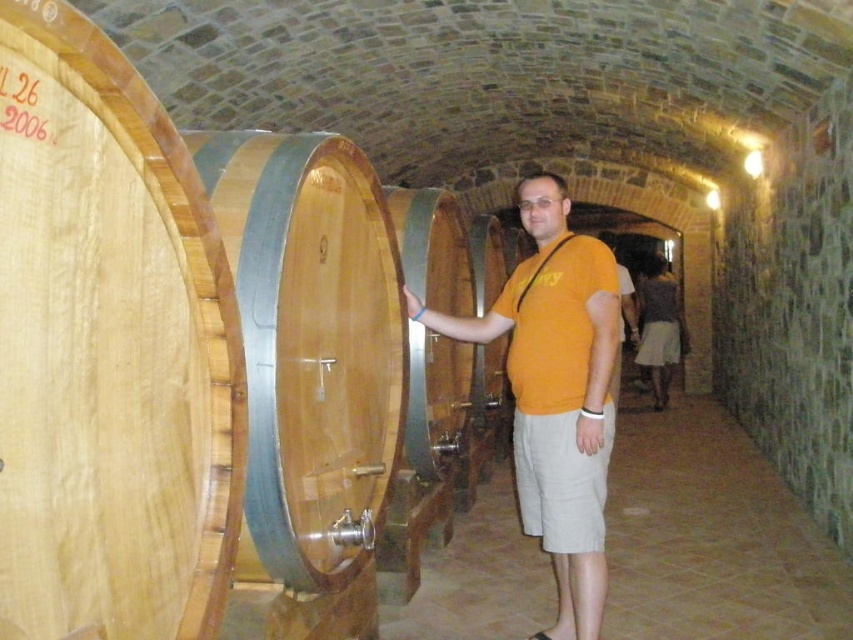
Which is below, natural wood barrel at left or orange cotton shirt at center?

orange cotton shirt at center

Does natural wood barrel at left appear on the right side of orange cotton shirt at center?

Incorrect, natural wood barrel at left is not on the right side of orange cotton shirt at center.

At what (x,y) coordinates should I click in order to perform the action: click on natural wood barrel at left. Please return your answer as a coordinate pair (x, y). Looking at the image, I should click on (108, 349).

At what (x,y) coordinates should I click in order to perform the action: click on natural wood barrel at left. Please return your answer as a coordinate pair (x, y). The image size is (853, 640). Looking at the image, I should click on (108, 349).

Is the position of natural wood barrel at center less distant than that of wooden barrel at center?

Yes, it is.

Does natural wood barrel at center have a lesser height compared to wooden barrel at center?

Yes, natural wood barrel at center is shorter than wooden barrel at center.

In order to click on natural wood barrel at center in this screenshot , I will do `click(310, 346)`.

Measure the distance from natural wood barrel at left to wooden barrel at center.

natural wood barrel at left is 2.25 meters from wooden barrel at center.

Is natural wood barrel at left bigger than wooden barrel at center?

No.

Describe the element at coordinates (108, 349) in the screenshot. I see `natural wood barrel at left` at that location.

In order to click on natural wood barrel at left in this screenshot , I will do `click(108, 349)`.